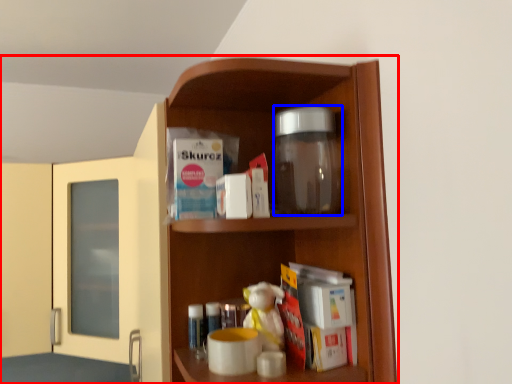
Question: Which object is further to the camera taking this photo, cupboard (highlighted by a red box) or glass jar (highlighted by a blue box)?

Choices:
 (A) cupboard
 (B) glass jar

Answer: (A)